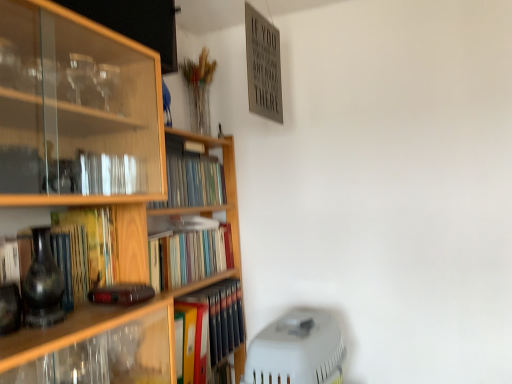
Question: Which is correct: matte black vase at left is inside hardcover book at center-left, acting as the second book starting from the top, or outside of it?

Choices:
 (A) inside
 (B) outside

Answer: (B)

Question: Considering the positions of matte black vase at left and hardcover book at center-left, the third book ordered from the bottom, in the image, is matte black vase at left taller or shorter than hardcover book at center-left, the third book ordered from the bottom,?

Choices:
 (A) tall
 (B) short

Answer: (B)

Question: Based on their relative distances, which object is farther from the hardcover book at center-left, the third book ordered from the bottom?

Choices:
 (A) hardcover book at center, which is the third book in top-to-bottom order
 (B) matte black vase at left
 (C) multicolored hardcover books at center, which is the first book in bottom-to-top order
 (D) wooden bookshelf at left
 (E) hardcover books at center, which is the first book in top-to-bottom order

Answer: (C)

Question: Estimate the real-world distances between objects in this image. Which object is farther from the wooden bookshelf at left?

Choices:
 (A) hardcover books at center, acting as the 4th book starting from the bottom
 (B) matte black vase at left
 (C) multicolored hardcover books at center, which is the first book in bottom-to-top order
 (D) hardcover book at center-left, the third book ordered from the bottom
 (E) hardcover book at center, which is the 2th book in bottom-to-top order

Answer: (B)